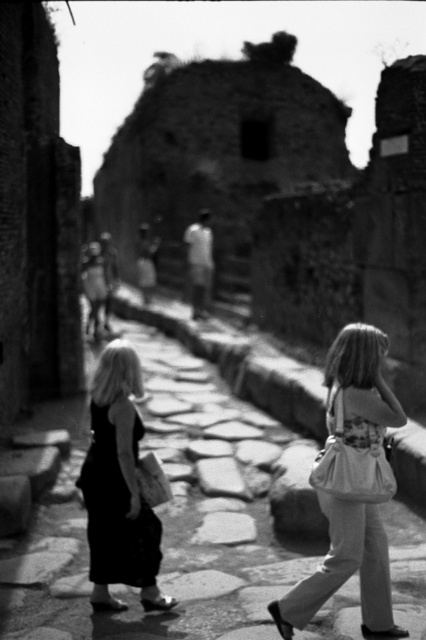
Question: Does pebble stone pavement at center appear under matte black dress at center?

Choices:
 (A) yes
 (B) no

Answer: (B)

Question: Which point is farther to the camera?

Choices:
 (A) matte black dress at center
 (B) pebble stone pavement at center
 (C) matte white purse at right

Answer: (A)

Question: Does matte white purse at right have a greater width compared to matte black dress at center?

Choices:
 (A) yes
 (B) no

Answer: (A)

Question: Which point is farther from the camera taking this photo?

Choices:
 (A) (108, 538)
 (B) (359, 484)

Answer: (A)

Question: Which of the following is the closest to the observer?

Choices:
 (A) matte black dress at center
 (B) pebble stone pavement at center
 (C) matte white purse at right

Answer: (C)

Question: Is matte white purse at right above matte black dress at center?

Choices:
 (A) no
 (B) yes

Answer: (B)